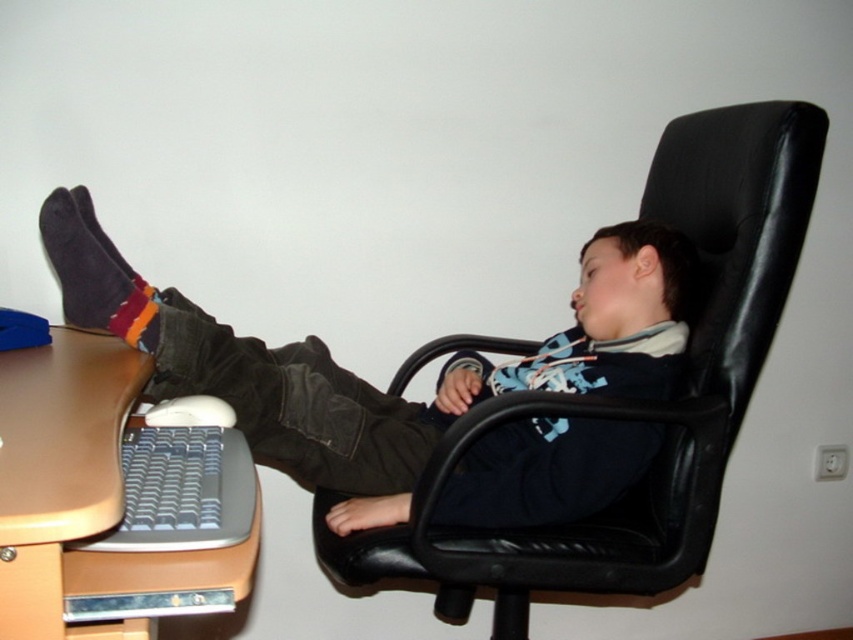
Is dark blue sweater at center positioned behind black leather swivel chair at center?

No, it is in front of black leather swivel chair at center.

Identify the location of dark blue sweater at center. The height and width of the screenshot is (640, 853). (360, 378).

How far apart are dark blue sweater at center and dark gray suede socks at lower left?

13.05 inches

Does dark blue sweater at center have a lesser width compared to dark gray suede socks at lower left?

In fact, dark blue sweater at center might be wider than dark gray suede socks at lower left.

This screenshot has height=640, width=853. In order to click on dark blue sweater at center in this screenshot , I will do `click(360, 378)`.

Locate an element on the screen. This screenshot has height=640, width=853. dark blue sweater at center is located at coordinates (360, 378).

Does dark blue sweater at center appear on the right side of brown wood computer desk at lower left?

Correct, you'll find dark blue sweater at center to the right of brown wood computer desk at lower left.

Which of these two, dark blue sweater at center or brown wood computer desk at lower left, stands shorter?

Standing shorter between the two is brown wood computer desk at lower left.

I want to click on dark blue sweater at center, so click(360, 378).